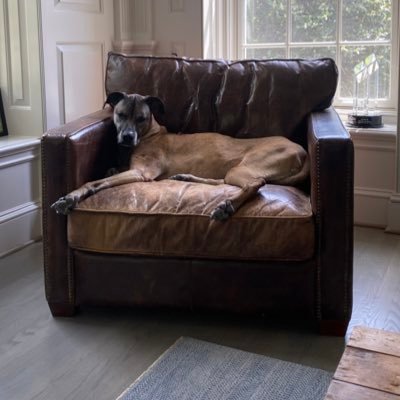
At what (x,y) coordinates should I click in order to perform the action: click on seat cushion. Please return your answer as a coordinate pair (x, y). Looking at the image, I should click on (176, 211).